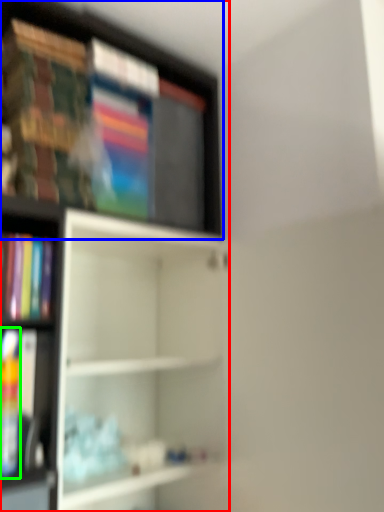
Question: Based on their relative distances, which object is nearer to shelf (highlighted by a red box)? Choose from shelf (highlighted by a blue box) and book (highlighted by a green box).

Choices:
 (A) shelf
 (B) book

Answer: (A)